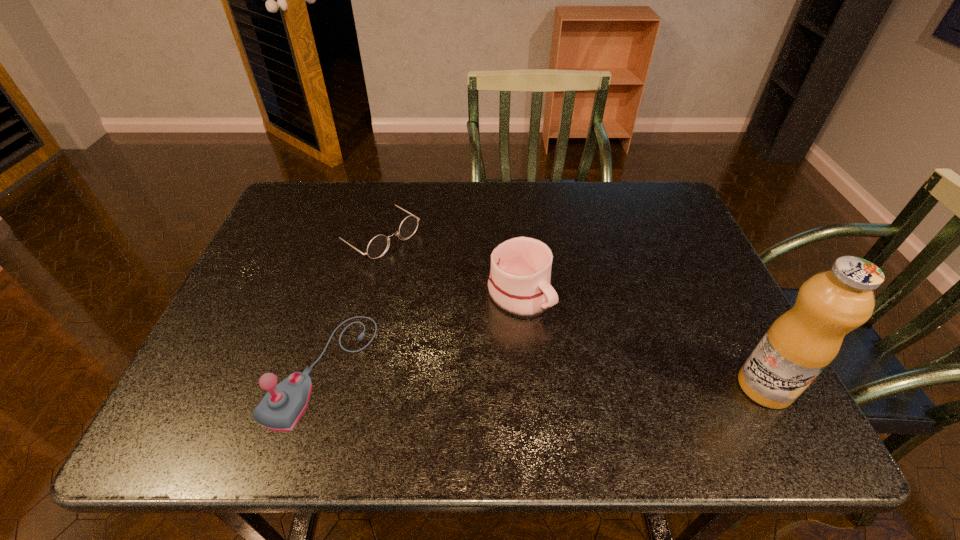
Where is `vacant area situated on the front-facing side of the spectacles`? The width and height of the screenshot is (960, 540). vacant area situated on the front-facing side of the spectacles is located at coordinates (482, 303).

The width and height of the screenshot is (960, 540). I want to click on vacant point located 0.150m on the front-facing side of the spectacles, so click(x=445, y=280).

At what (x,y) coordinates should I click in order to perform the action: click on vacant region located on the front-facing side of the spectacles. Please return your answer as a coordinate pair (x, y). This screenshot has height=540, width=960. Looking at the image, I should click on (509, 320).

At what (x,y) coordinates should I click in order to perform the action: click on object that is positioned at the far edge. Please return your answer as a coordinate pair (x, y). This screenshot has width=960, height=540. Looking at the image, I should click on (376, 248).

At what (x,y) coordinates should I click in order to perform the action: click on joystick located in the near edge section of the desktop. Please return your answer as a coordinate pair (x, y). Looking at the image, I should click on (281, 408).

Find the location of `fruit juice at the near edge`. fruit juice at the near edge is located at coordinates pyautogui.click(x=802, y=342).

Locate an element on the screen. The height and width of the screenshot is (540, 960). joystick located at the left edge is located at coordinates (281, 408).

Image resolution: width=960 pixels, height=540 pixels. I want to click on spectacles that is at the left edge, so click(x=376, y=248).

Identify the location of object at the right edge. (802, 342).

This screenshot has height=540, width=960. In order to click on object at the far left corner in this screenshot , I will do `click(376, 248)`.